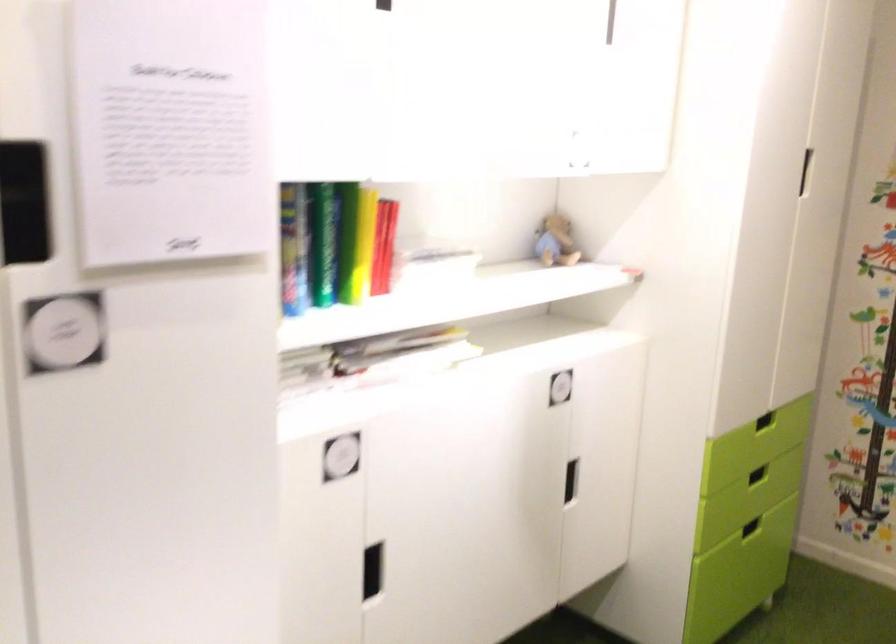
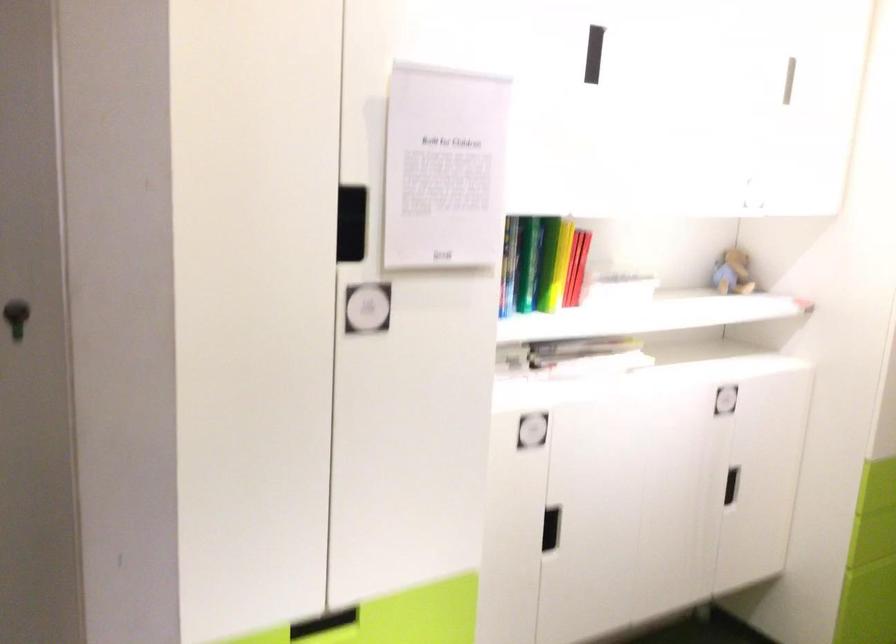
In the second image, find the point that corresponds to [368,241] in the first image.

(561, 263)